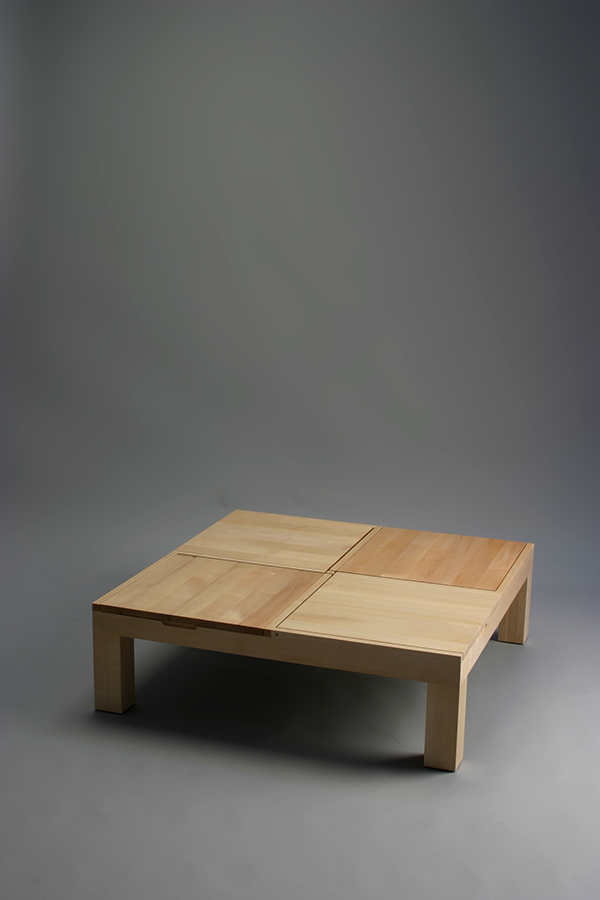
I want to click on small wood table, so click(321, 579).